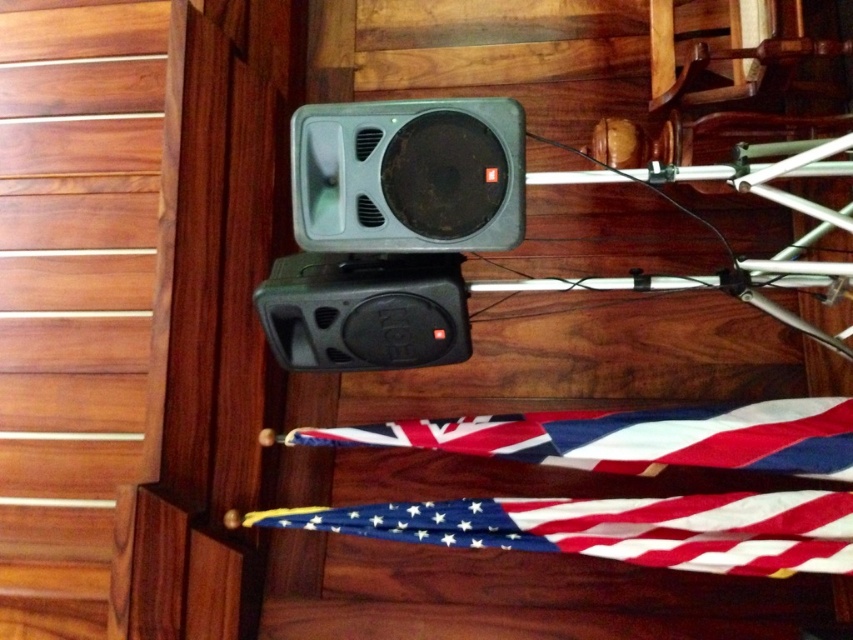
Question: Among these points, which one is nearest to the camera?

Choices:
 (A) (431, 275)
 (B) (839, 502)
 (C) (434, 449)
 (D) (13, 180)

Answer: (B)

Question: Can you confirm if wooden panel at upper left is positioned below black plastic speaker at center?

Choices:
 (A) no
 (B) yes

Answer: (A)

Question: Can you confirm if wooden panel at upper left is positioned below polyester flag at lower center?

Choices:
 (A) no
 (B) yes

Answer: (A)

Question: Which of the following is the closest to the observer?

Choices:
 (A) polyester flag at lower center
 (B) black plastic speaker at center
 (C) american flag at lower center
 (D) wooden panel at upper left

Answer: (B)

Question: Estimate the real-world distances between objects in this image. Which object is closer to the black plastic speaker at center?

Choices:
 (A) wooden panel at upper left
 (B) american flag at lower center
 (C) polyester flag at lower center
 (D) matte black speaker at center

Answer: (D)

Question: Does american flag at lower center have a smaller size compared to black plastic speaker at center?

Choices:
 (A) yes
 (B) no

Answer: (B)